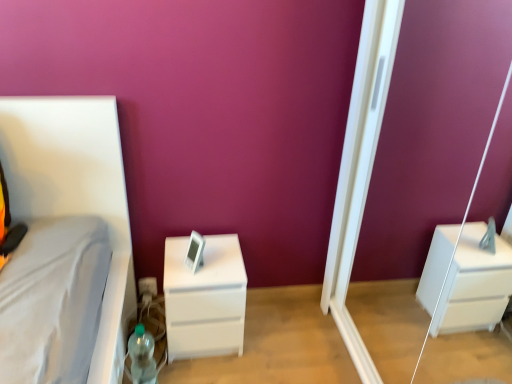
Question: From a real-world perspective, is translucent plastic bottle at lower left below white matte chest of drawers at center?

Choices:
 (A) yes
 (B) no

Answer: (A)

Question: Does translucent plastic bottle at lower left contain white matte chest of drawers at center?

Choices:
 (A) yes
 (B) no

Answer: (B)

Question: Can you confirm if translucent plastic bottle at lower left is thinner than white matte chest of drawers at center?

Choices:
 (A) no
 (B) yes

Answer: (B)

Question: Can you confirm if translucent plastic bottle at lower left is positioned to the left of white matte chest of drawers at center?

Choices:
 (A) no
 (B) yes

Answer: (B)

Question: Can you confirm if translucent plastic bottle at lower left is smaller than white matte chest of drawers at center?

Choices:
 (A) yes
 (B) no

Answer: (A)

Question: Is translucent plastic bottle at lower left outside white matte chest of drawers at center?

Choices:
 (A) yes
 (B) no

Answer: (A)

Question: Does white matte chest of drawers at center have a lesser width compared to white glossy screen door at right?

Choices:
 (A) yes
 (B) no

Answer: (B)

Question: Is the position of white matte chest of drawers at center more distant than that of white glossy screen door at right?

Choices:
 (A) yes
 (B) no

Answer: (A)

Question: Considering the relative sizes of white matte chest of drawers at center and white glossy screen door at right in the image provided, is white matte chest of drawers at center smaller than white glossy screen door at right?

Choices:
 (A) no
 (B) yes

Answer: (B)

Question: From a real-world perspective, is white matte chest of drawers at center physically below white glossy screen door at right?

Choices:
 (A) no
 (B) yes

Answer: (B)

Question: Is white glossy screen door at right inside white matte chest of drawers at center?

Choices:
 (A) yes
 (B) no

Answer: (B)

Question: Could you tell me if white matte chest of drawers at center is turned towards white glossy screen door at right?

Choices:
 (A) no
 (B) yes

Answer: (A)

Question: Is white glossy screen door at right at the left side of white matte chest of drawers at center?

Choices:
 (A) no
 (B) yes

Answer: (A)